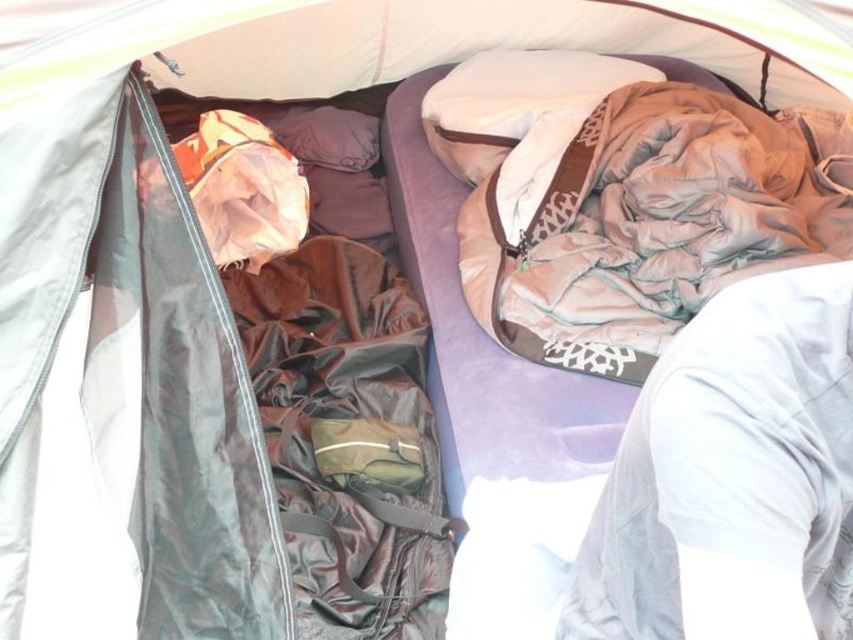
You are inside a tent and want to place a small item on the white fabric at lower right. Based on the scene description, can you tell me the exact coordinates where you should place it?

The white fabric at lower right is located at point (730,476), so you should place the item there.